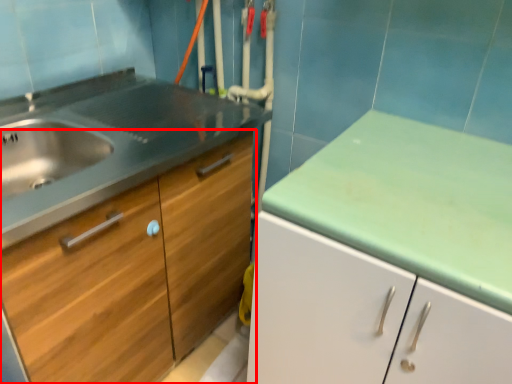
Question: From the image's perspective, what is the correct spatial relationship of cabinetry (annotated by the red box) in relation to drawer?

Choices:
 (A) above
 (B) below

Answer: (B)